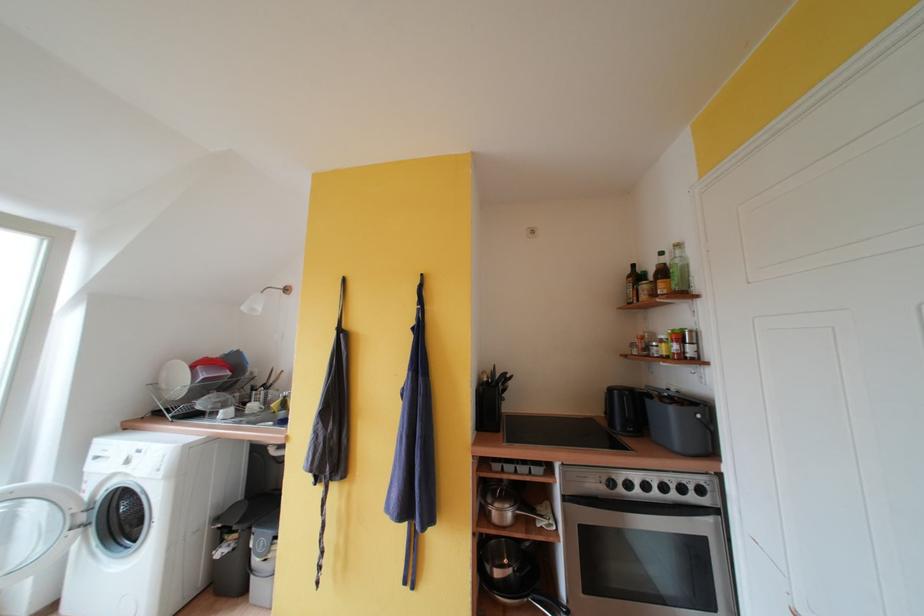
You are a GUI agent. You are given a task and a screenshot of the screen. Output one action in this format:
    pyautogui.click(x=<x>, y=<y>)
    Task: Click on the white plate
    The height and width of the screenshot is (616, 924).
    Given the screenshot: What is the action you would take?
    pyautogui.click(x=174, y=376)